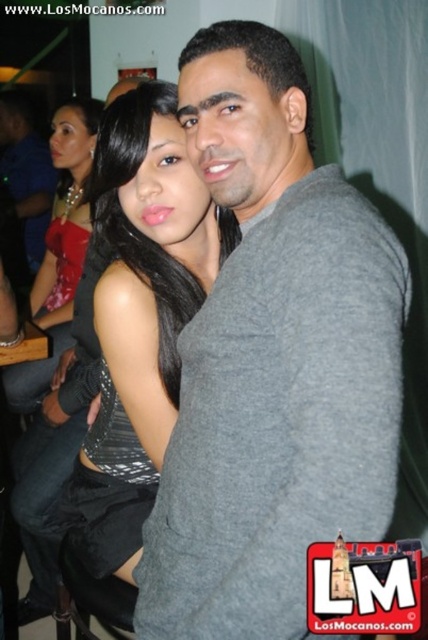
You are a photographer at the event and want to capture a closeup of the gray cotton shirt at center. Based on its position, where should you aim your camera?

The gray cotton shirt at center is located at point (273, 360), so aim your camera at those coordinates to capture the closeup.

You are a photographer at a party and notice the gray cotton shirt at center and the satin silver dress at center. Which clothing item is shorter in length?

The gray cotton shirt at center is shorter than the satin silver dress at center.